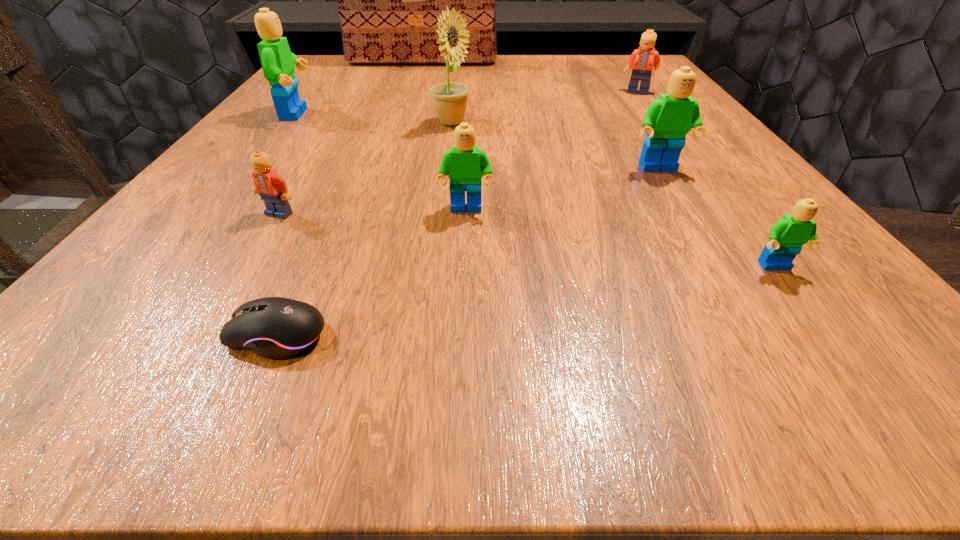
Where is `free spot located 0.080m on the face of the fifth shortest Lego`? free spot located 0.080m on the face of the fifth shortest Lego is located at coordinates (681, 204).

Identify the location of vacant region located 0.200m on the front-facing side of the bigger orange Lego. (670, 136).

Identify the location of vacant space situated 0.220m on the face of the fourth Lego from right to left. The image size is (960, 540). (461, 344).

Locate an element on the screen. The image size is (960, 540). free space located on the front-facing side of the smaller orange Lego is located at coordinates (247, 269).

Locate an element on the screen. The height and width of the screenshot is (540, 960). free point located on the face of the second nearest object is located at coordinates (858, 376).

At what (x,y) coordinates should I click in order to perform the action: click on vacant space located 0.050m on the left of the nearest object. Please return your answer as a coordinate pair (x, y). This screenshot has height=540, width=960. Looking at the image, I should click on (180, 335).

The image size is (960, 540). What are the coordinates of `object present at the far edge` in the screenshot? It's located at (388, 0).

Find the location of a particular element. object that is at the near edge is located at coordinates (276, 328).

Identify the location of handbag that is positioned at the left edge. Image resolution: width=960 pixels, height=540 pixels. (388, 0).

Image resolution: width=960 pixels, height=540 pixels. Find the location of `object situated at the far left corner`. object situated at the far left corner is located at coordinates (388, 0).